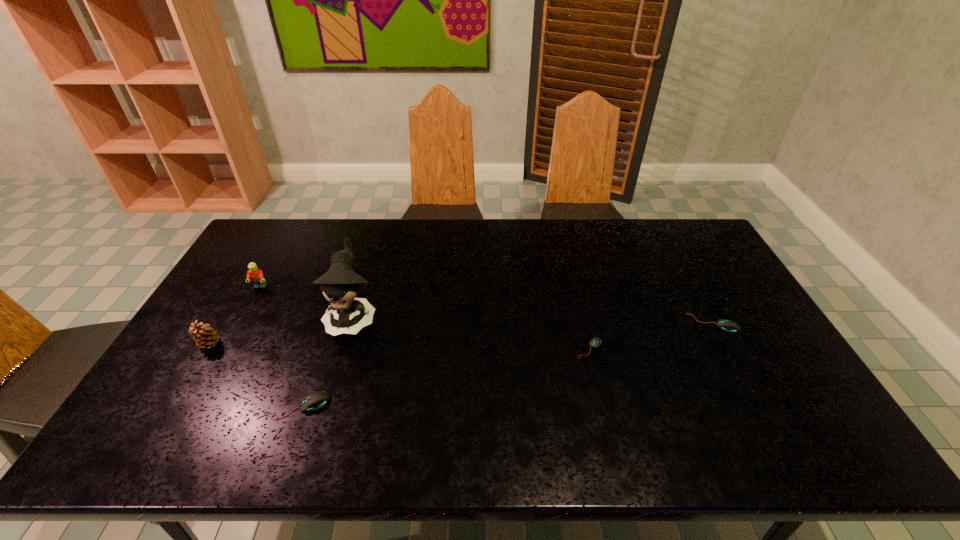
You are a GUI agent. You are given a task and a screenshot of the screen. Output one action in this format:
    pyautogui.click(x=<x>, y=<y>)
    Task: Click on the vacant space that's between the rightmost mouse and the tallest object
    
    Given the screenshot: What is the action you would take?
    pyautogui.click(x=533, y=320)

This screenshot has height=540, width=960. Identify the location of free space that is in between the leftmost mouse and the pinecone. (252, 375).

The image size is (960, 540). What are the coordinates of `vacant point located between the doll and the nearest object` in the screenshot? It's located at (324, 361).

At what (x,y) coordinates should I click in order to perform the action: click on free space between the rightmost mouse and the farthest object. Please return your answer as a coordinate pair (x, y). Image resolution: width=960 pixels, height=540 pixels. Looking at the image, I should click on (487, 305).

Where is `free point between the doll and the pinecone`? The width and height of the screenshot is (960, 540). free point between the doll and the pinecone is located at coordinates (281, 330).

Image resolution: width=960 pixels, height=540 pixels. I want to click on object that is the closest to the farthest object, so click(x=205, y=337).

Identify which object is the fifth nearest to the doll. Please provide its 2D coordinates. Your answer should be formatted as a tuple, i.e. [(x, y)], where the tuple contains the x and y coordinates of a point satisfying the conditions above.

[(727, 325)]

Identify which mouse is the closest to the farthest mouse. Please provide its 2D coordinates. Your answer should be formatted as a tuple, i.e. [(x, y)], where the tuple contains the x and y coordinates of a point satisfying the conditions above.

[(596, 341)]

Image resolution: width=960 pixels, height=540 pixels. Find the location of `mouse that is the second nearest to the pinecone`. mouse that is the second nearest to the pinecone is located at coordinates (596, 341).

You are a GUI agent. You are given a task and a screenshot of the screen. Output one action in this format:
    pyautogui.click(x=<x>, y=<y>)
    Task: Click on the vacant area that satisfies the following two spatial constraints: 1. at the face of the second mouse from right to left; 2. on the right side of the doll
    This screenshot has width=960, height=540.
    Given the screenshot: What is the action you would take?
    pyautogui.click(x=344, y=348)